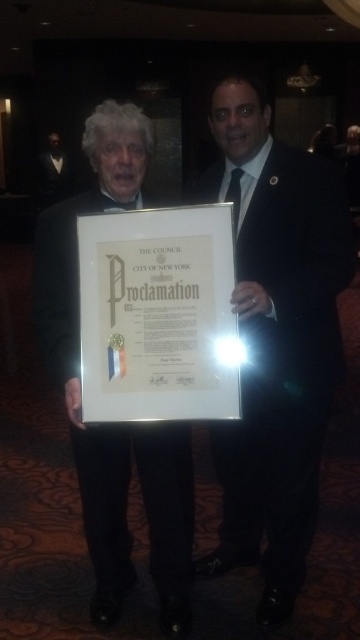
Can you confirm if black suit at center is positioned below white paper at center?

Indeed, black suit at center is positioned under white paper at center.

Can you confirm if black suit at center is thinner than white paper at center?

No.

Which is in front, point (281, 371) or point (183, 332)?

Point (183, 332)

Where is `black suit at center`? black suit at center is located at coordinates (276, 339).